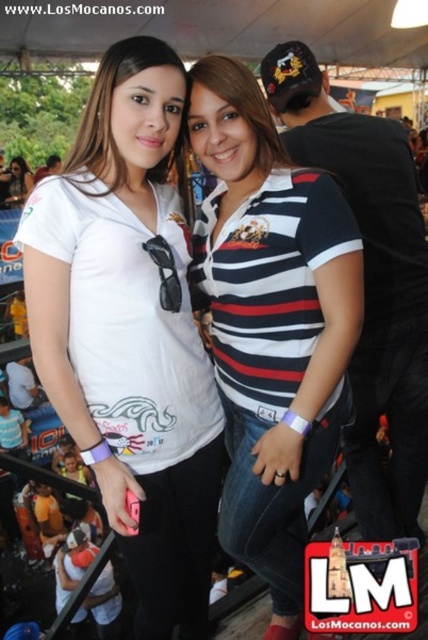
You are organizing a charity event and need to arrange two donated shirts for a raffle. The striped cotton shirt at center and the matte white shirt at upper left must be displayed on mannequins. Given their sizes, which shirt should be placed on the larger mannequin?

The matte white shirt at upper left should be placed on the larger mannequin because the striped cotton shirt at center occupies less space than the matte white shirt at upper left, indicating it is smaller.